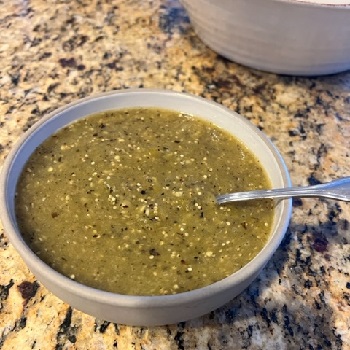
What are the coordinates of `bowl` in the screenshot? It's located at (69, 298).